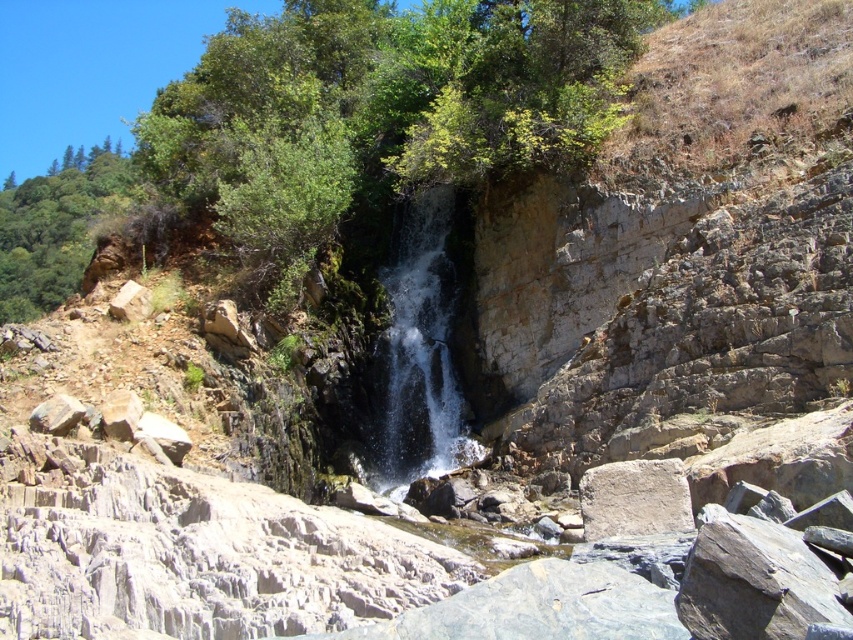
Does clear water at center have a larger size compared to gray rough stone at center?

Indeed, clear water at center has a larger size compared to gray rough stone at center.

Can you confirm if clear water at center is shorter than gray rough stone at center?

No.

Who is more forward, (434, 458) or (663, 477)?

Positioned in front is point (663, 477).

The width and height of the screenshot is (853, 640). Identify the location of clear water at center. (421, 355).

Is clear water at center positioned before green leafy tree at upper left?

Yes, it is.

Is point (453, 412) closer to viewer compared to point (24, 234)?

Yes, it is.

You are a GUI agent. You are given a task and a screenshot of the screen. Output one action in this format:
    pyautogui.click(x=<x>, y=<y>)
    Task: Click on the clear water at center
    
    Given the screenshot: What is the action you would take?
    pyautogui.click(x=421, y=355)

Does green leafy tree at upper left come in front of gray rough stone at center?

No.

Can you confirm if green leafy tree at upper left is positioned above gray rough stone at center?

Correct, green leafy tree at upper left is located above gray rough stone at center.

At what (x,y) coordinates should I click in order to perform the action: click on green leafy tree at upper left. Please return your answer as a coordinate pair (x, y). The height and width of the screenshot is (640, 853). Looking at the image, I should click on (54, 227).